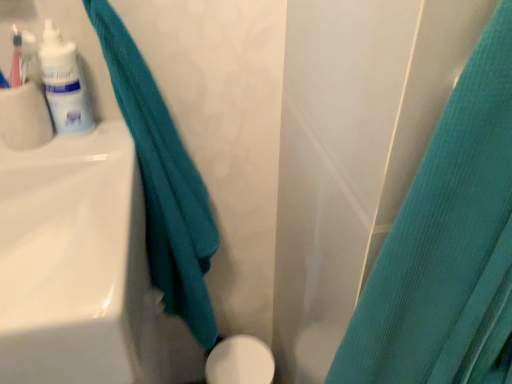
Identify the location of vacant area that is in front of white glossy lotion at upper left. This screenshot has height=384, width=512. (77, 164).